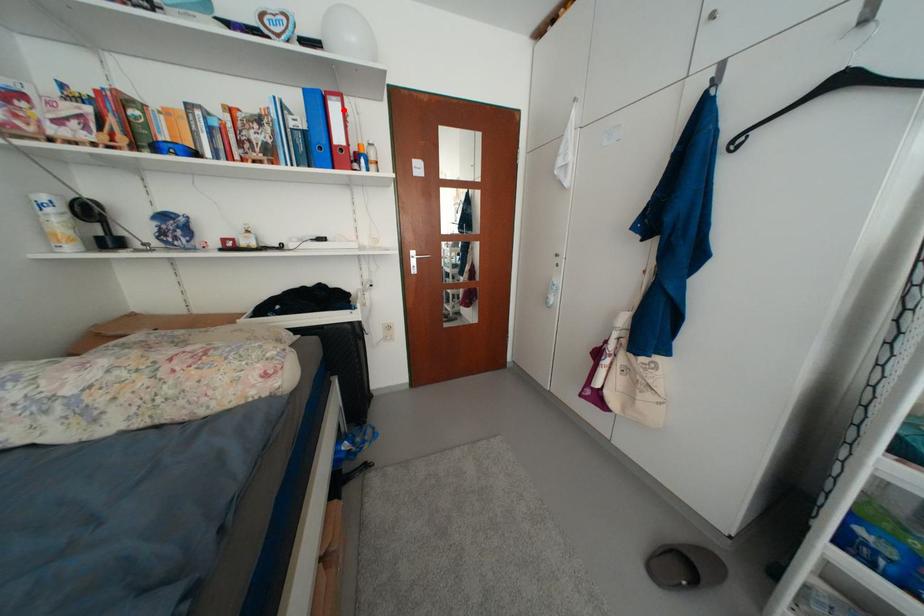
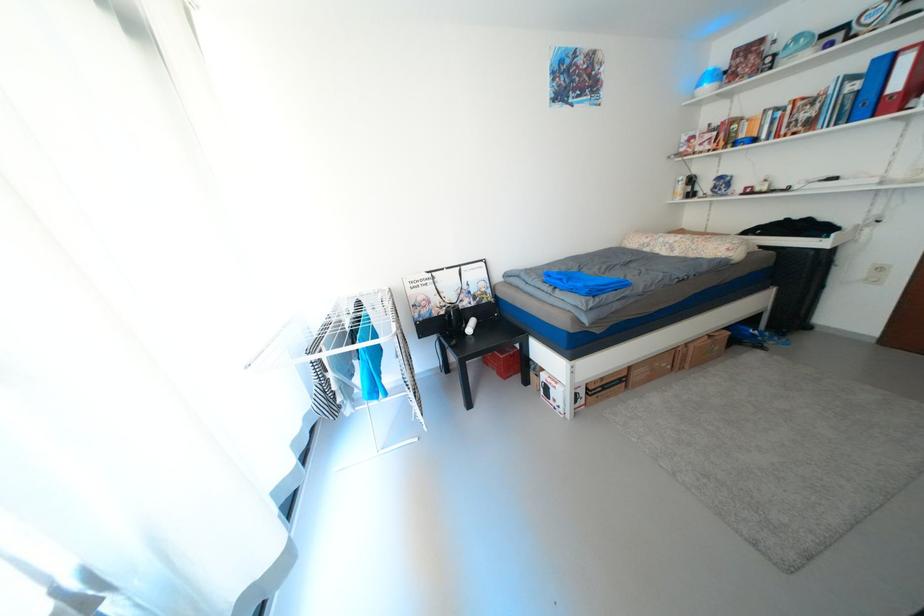
Where in the second image is the point corresponding to the highlighted location from the first image?

(916, 62)